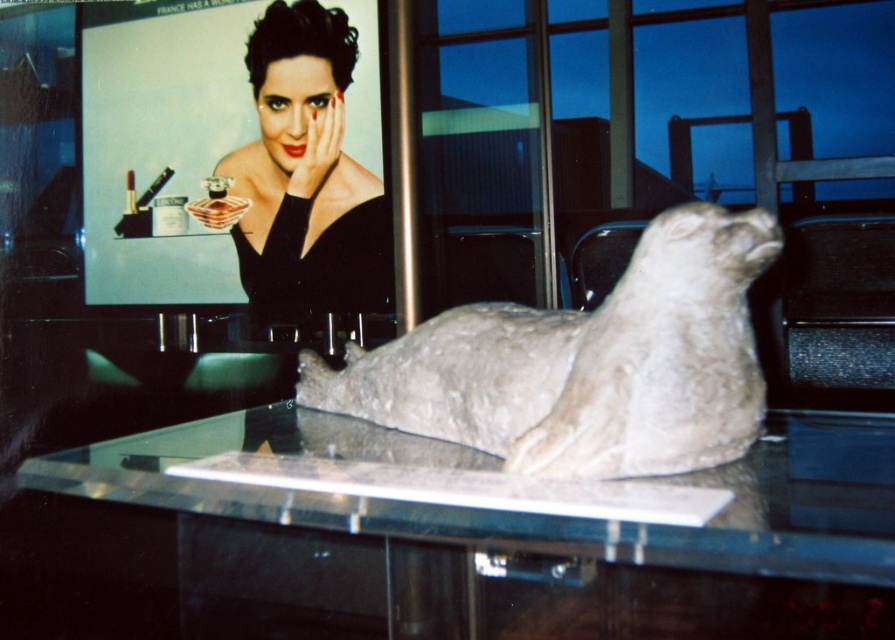
Question: Can you confirm if clear glass table at center is positioned to the left of matte black dress at upper center?

Choices:
 (A) no
 (B) yes

Answer: (A)

Question: Which is farther from the matte black dress at upper center?

Choices:
 (A) clear glass table at center
 (B) gray stone seal at center

Answer: (B)

Question: Which point appears closest to the camera in this image?

Choices:
 (A) (343, 93)
 (B) (193, 602)

Answer: (B)

Question: Which object appears farthest from the camera in this image?

Choices:
 (A) matte black dress at upper center
 (B) clear glass table at center

Answer: (A)

Question: Is clear glass table at center to the left of matte black dress at upper center from the viewer's perspective?

Choices:
 (A) yes
 (B) no

Answer: (B)

Question: Can you confirm if gray stone seal at center is positioned to the left of matte black dress at upper center?

Choices:
 (A) yes
 (B) no

Answer: (B)